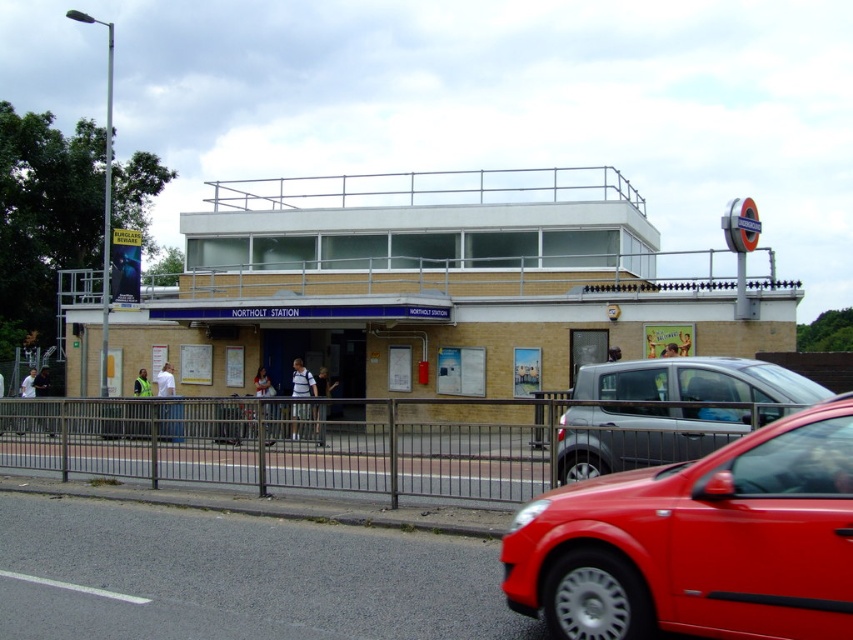
Is shiny red car at lower right further to the viewer compared to metallic gray fence at lower center?

That is False.

Between point (677, 600) and point (538, 406), which one is positioned behind?

The point (538, 406) is more distant.

Locate an element on the screen. This screenshot has height=640, width=853. shiny red car at lower right is located at coordinates (699, 541).

Between shiny red car at lower right and silver metallic hatchback at right, which one is positioned higher?

silver metallic hatchback at right

Identify the location of shiny red car at lower right. (699, 541).

This screenshot has height=640, width=853. What are the coordinates of `shiny red car at lower right` in the screenshot? It's located at (699, 541).

Between point (218, 477) and point (646, 442), which one is positioned in front?

Positioned in front is point (646, 442).

Between metallic gray fence at lower center and silver metallic hatchback at right, which one is positioned lower?

metallic gray fence at lower center

Between point (61, 440) and point (770, 404), which one is positioned in front?

Point (770, 404) is more forward.

Find the location of a particular element. metallic gray fence at lower center is located at coordinates (294, 444).